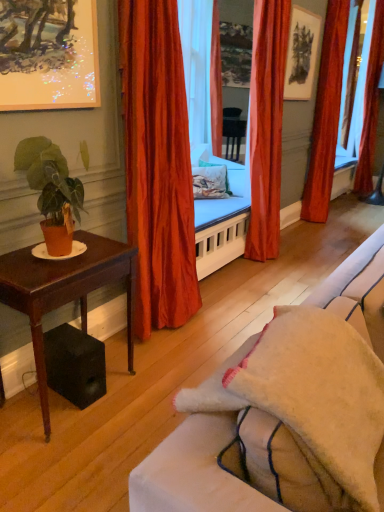
Measure the distance between matte orange pot at left and camera.

matte orange pot at left and camera are 5.77 feet apart from each other.

Find the location of a particular element. beige fabric couch at center is located at coordinates (286, 410).

In order to click on velvet orange curtain at center, which appears as the second curtain when viewed from the right in this screenshot , I will do `click(326, 115)`.

Is transparent glass window screen at right at the left side of mahogany wood side table at left?

No.

Can you tell me how much transparent glass window screen at right and mahogany wood side table at left differ in facing direction?

They differ by 1.02 degrees in their facing directions.

Is transparent glass window screen at right taller or shorter than mahogany wood side table at left?

→ Clearly, transparent glass window screen at right is taller compared to mahogany wood side table at left.

Is transparent glass window screen at right in front of mahogany wood side table at left?

That is False.

Between mahogany wood side table at left and metallic silver picture frame at upper left, the 2th picture frame positioned from the back, which one has more height?

With more height is mahogany wood side table at left.

Could you tell me if mahogany wood side table at left is turned towards metallic silver picture frame at upper left, the 2th picture frame positioned from the back?

No.

Can you confirm if mahogany wood side table at left is smaller than metallic silver picture frame at upper left, the second picture frame from the right?

No, mahogany wood side table at left is not smaller than metallic silver picture frame at upper left, the second picture frame from the right.

Visually, is velvet orange curtain at center, the third curtain from the right, positioned to the left or to the right of matte black picture frame at upper center, which is the 2th picture frame from bottom to top?

velvet orange curtain at center, the third curtain from the right, is to the left of matte black picture frame at upper center, which is the 2th picture frame from bottom to top.

Can you confirm if velvet orange curtain at center, the second curtain when ordered from left to right, is shorter than matte black picture frame at upper center, the second picture frame positioned from the front?

No.

Does point (248, 237) appear closer or farther from the camera than point (298, 71)?

Point (248, 237) is positioned closer to the camera compared to point (298, 71).

Is matte black picture frame at upper center, the second picture frame positioned from the front, inside velvet orange curtain at center, which ranks as the 3th curtain in back-to-front order?

No, matte black picture frame at upper center, the second picture frame positioned from the front, is not a part of velvet orange curtain at center, which ranks as the 3th curtain in back-to-front order.

Does velvet orange curtain at right, which is the fourth curtain from front to back, have a smaller size compared to velvet orange curtain at center, the third curtain from the right?

Yes.

Looking at this image, from a real-world perspective, which object rests below the other?

In real-world perspective, velvet orange curtain at right, which is the first curtain from back to front, is lower.

Considering the points (377, 3) and (267, 149), which point is in front, point (377, 3) or point (267, 149)?

Positioned in front is point (267, 149).

Could you measure the distance between velvet orange curtain at right, acting as the 1th curtain starting from the right, and velvet orange curtain at center, which ranks as the 3th curtain in back-to-front order?

velvet orange curtain at right, acting as the 1th curtain starting from the right, is 2.64 meters from velvet orange curtain at center, which ranks as the 3th curtain in back-to-front order.

Is metallic silver picture frame at upper left, the 2th picture frame positioned from the back, situated inside mahogany wood side table at left or outside?

The correct answer is: outside.

From a real-world perspective, who is located lower, metallic silver picture frame at upper left, the first picture frame ordered from the bottom, or mahogany wood side table at left?

mahogany wood side table at left, from a real-world perspective.

Can you confirm if metallic silver picture frame at upper left, arranged as the first picture frame when viewed from the left, is bigger than mahogany wood side table at left?

Incorrect, metallic silver picture frame at upper left, arranged as the first picture frame when viewed from the left, is not larger than mahogany wood side table at left.

Is metallic silver picture frame at upper left, the 2th picture frame positioned from the back, positioned behind mahogany wood side table at left?

No.

Measure the distance from floral fabric pillow at center to satin orange curtain at center, acting as the fourth curtain starting from the right.

floral fabric pillow at center is 4.32 feet from satin orange curtain at center, acting as the fourth curtain starting from the right.

From the image's perspective, which object appears higher, floral fabric pillow at center or satin orange curtain at center, acting as the fourth curtain starting from the right?

floral fabric pillow at center appears higher in the image.

Which object is positioned more to the left, floral fabric pillow at center or satin orange curtain at center, acting as the fourth curtain starting from the right?

satin orange curtain at center, acting as the fourth curtain starting from the right.

Based on the photo, is floral fabric pillow at center next to satin orange curtain at center, positioned as the 1th curtain in front-to-back order?

They are not placed beside each other.

Is matte orange pot at left oriented away from velvet orange curtain at center, which ranks as the 3th curtain in back-to-front order?

No, matte orange pot at left is not facing away from velvet orange curtain at center, which ranks as the 3th curtain in back-to-front order.

Measure the distance between matte orange pot at left and velvet orange curtain at center, placed as the second curtain when sorted from front to back.

A distance of 2.08 meters exists between matte orange pot at left and velvet orange curtain at center, placed as the second curtain when sorted from front to back.

Between matte orange pot at left and velvet orange curtain at center, the second curtain when ordered from left to right, which one is positioned in front?

matte orange pot at left is more forward.

The height and width of the screenshot is (512, 384). What are the coordinates of `houseplant in front of the velvet orange curtain at center, which ranks as the 3th curtain in back-to-front order` in the screenshot? It's located at (52, 191).

Identify the location of window screen behind the mahogany wood side table at left. The image size is (384, 512). (355, 89).

From a real-world perspective, starting from the mahogany wood side table at left, which picture frame is the 1st one vertically above it? Please provide its 2D coordinates.

[(48, 54)]

Which object lies nearer to the anchor point beige fabric couch at center, metallic silver picture frame at upper left, arranged as the first picture frame when viewed from the left, or satin orange curtain at center, the fourth curtain positioned from the back?

satin orange curtain at center, the fourth curtain positioned from the back, lies closer to beige fabric couch at center than the other object.

When comparing their distances from floral fabric pillow at center, does velvet orange curtain at center, the second curtain when ordered from left to right, or velvet orange curtain at center, the third curtain from the front, seem closer?

velvet orange curtain at center, the second curtain when ordered from left to right, lies closer to floral fabric pillow at center than the other object.

From the image, which object appears to be farther from beige fabric couch at center, velvet orange curtain at center, which ranks as the 3th curtain in back-to-front order, or floral fabric pillow at center?

The object further to beige fabric couch at center is floral fabric pillow at center.

Estimate the real-world distances between objects in this image. Which object is further from velvet orange curtain at center, the third curtain from the right, velvet orange curtain at right, which is the fourth curtain from front to back, or metallic silver picture frame at upper left, the first picture frame ordered from the bottom?

velvet orange curtain at right, which is the fourth curtain from front to back, lies further to velvet orange curtain at center, the third curtain from the right, than the other object.

Estimate the real-world distances between objects in this image. Which object is closer to transparent glass window screen at right, satin orange curtain at center, acting as the fourth curtain starting from the right, or mahogany wood side table at left?

satin orange curtain at center, acting as the fourth curtain starting from the right, is positioned closer to the anchor transparent glass window screen at right.

Which object lies further to the anchor point transparent glass window screen at right, velvet orange curtain at center, the second curtain when ordered from left to right, or velvet orange curtain at right, which is the fourth curtain from front to back?

Among the two, velvet orange curtain at center, the second curtain when ordered from left to right, is located further to transparent glass window screen at right.

From the image, which object appears to be nearer to matte black picture frame at upper center, the second picture frame from the left, velvet orange curtain at center, the third curtain from the right, or mahogany wood side table at left?

Among the two, velvet orange curtain at center, the third curtain from the right, is located nearer to matte black picture frame at upper center, the second picture frame from the left.

Which object lies nearer to the anchor point matte black picture frame at upper center, the second picture frame positioned from the front, metallic silver picture frame at upper left, marked as the 1th picture frame in a front-to-back arrangement, or floral fabric pillow at center?

floral fabric pillow at center is positioned closer to the anchor matte black picture frame at upper center, the second picture frame positioned from the front.

The image size is (384, 512). I want to click on picture frame between mahogany wood side table at left and transparent glass window screen at right in the front-back direction, so click(x=301, y=54).

Locate an element on the screen. The width and height of the screenshot is (384, 512). pillow between satin orange curtain at center, positioned as the 1th curtain in front-to-back order, and transparent glass window screen at right from front to back is located at coordinates (210, 182).

I want to click on picture frame between mahogany wood side table at left and velvet orange curtain at center, which appears as the second curtain when viewed from the right, along the z-axis, so click(301, 54).

Locate an element on the screen. curtain located between velvet orange curtain at center, which ranks as the 3th curtain in back-to-front order, and transparent glass window screen at right in the depth direction is located at coordinates (326, 115).